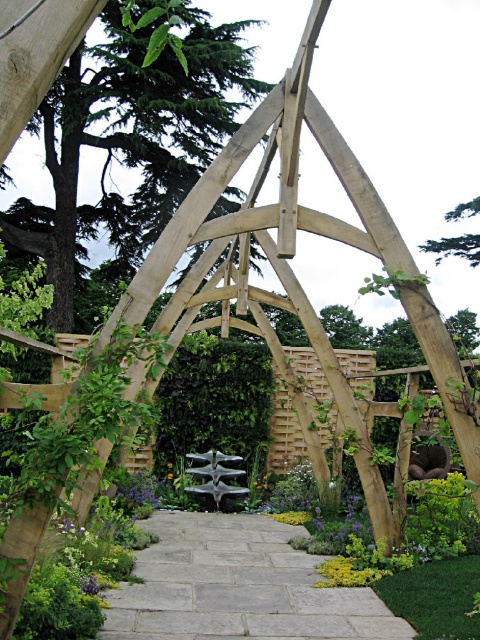
You are standing in the garden and want to walk from the point at the center of the path to the wooden arbor. Which direction should you move relative to the two points labeled point (284, 525) and point (171, 474)?

Since point (284, 525) is in front of point (171, 474), you should move towards point (284, 525) to reach the wooden arbor from the center of the path.

You are a gardener who wants to place a new decorative statue on the gray stone path at center. Considering the size of the yellow matte flower at center, will the statue fit comfortably on the path without overcrowding the area?

The gray stone path at center is larger in size than the yellow matte flower at center, so placing the statue on the path should be feasible as there is enough space available.